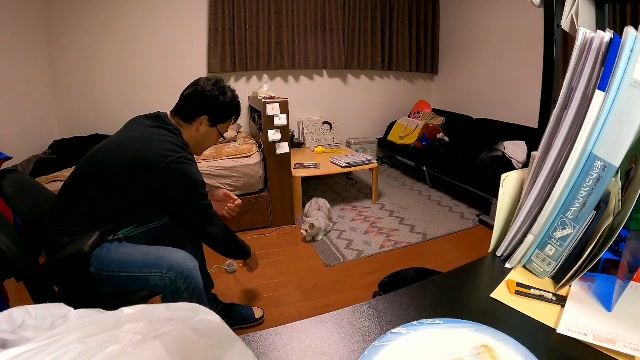
This screenshot has width=640, height=360. I want to click on blue rim around white plate, so click(x=413, y=327).